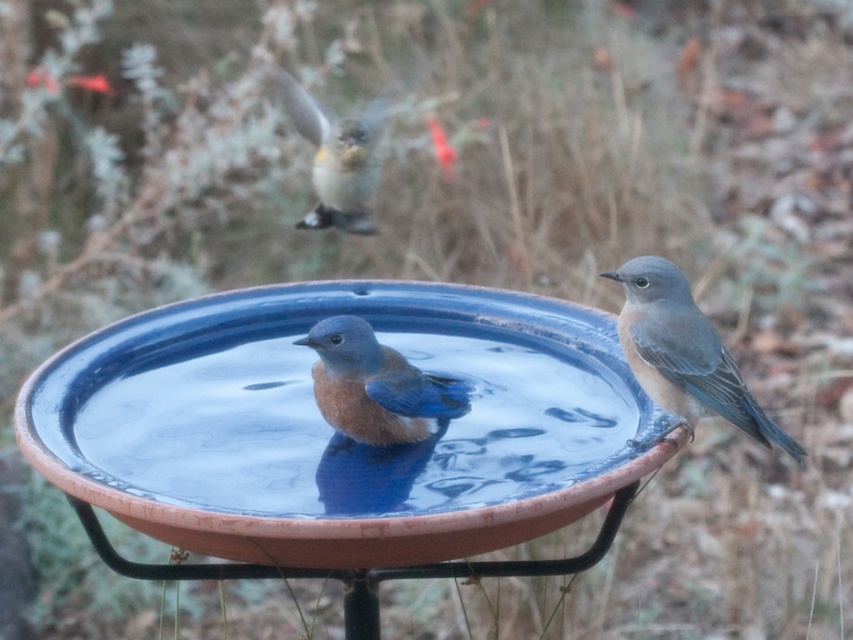
Does blue-gray feathers at center lie behind blue glossy bird at upper center?

No, blue-gray feathers at center is in front of blue glossy bird at upper center.

Is blue-gray feathers at center taller than blue glossy bird at upper center?

No.

Which is in front, point (653, 372) or point (363, 113)?

Point (653, 372)

This screenshot has height=640, width=853. Find the location of `blue-gray feathers at center`. blue-gray feathers at center is located at coordinates (683, 353).

Is blue glossy bird at center smaller than blue glossy bird at upper center?

Yes.

Is point (442, 396) less distant than point (373, 108)?

Yes, point (442, 396) is closer to viewer.

Locate an element on the screen. The image size is (853, 640). blue glossy bird at center is located at coordinates (376, 385).

Between point (654, 371) and point (351, 372), which one is positioned in front?

Point (351, 372)

Is blue-gray feathers at center wider than blue glossy bird at center?

Correct, the width of blue-gray feathers at center exceeds that of blue glossy bird at center.

Identify the location of blue-gray feathers at center. The width and height of the screenshot is (853, 640). (683, 353).